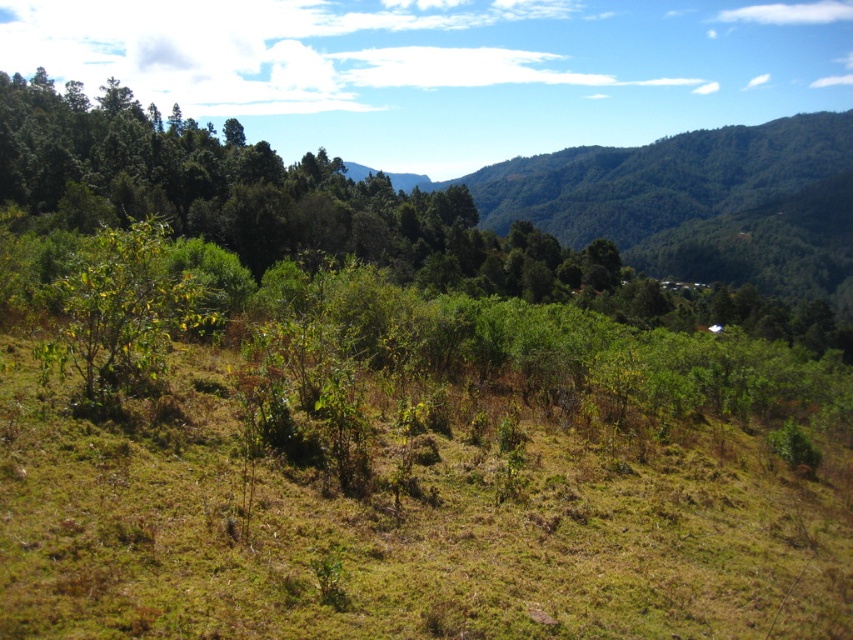
Is point (612, 564) positioned after point (151, 384)?

No, it is not.

The width and height of the screenshot is (853, 640). Find the location of `green grassy at center`. green grassy at center is located at coordinates (408, 524).

Is point (598, 481) positioned after point (102, 230)?

No, (598, 481) is in front of (102, 230).

Identify the location of green grassy at center. Image resolution: width=853 pixels, height=640 pixels. (408, 524).